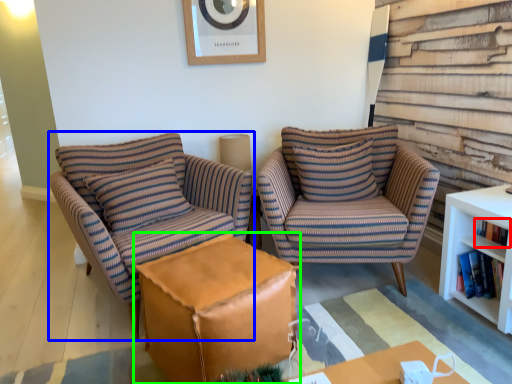
Question: Which is nearer to the book (highlighted by a red box)? chair (highlighted by a blue box) or table (highlighted by a green box).

Choices:
 (A) chair
 (B) table

Answer: (B)